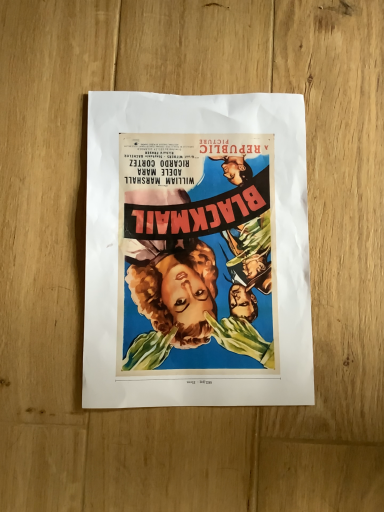
This screenshot has width=384, height=512. What do you see at coordinates (196, 252) in the screenshot?
I see `matte paper poster at center` at bounding box center [196, 252].

The image size is (384, 512). In order to click on matte paper poster at center in this screenshot , I will do `click(196, 252)`.

Locate an element on the screen. The height and width of the screenshot is (512, 384). matte paper poster at center is located at coordinates (196, 252).